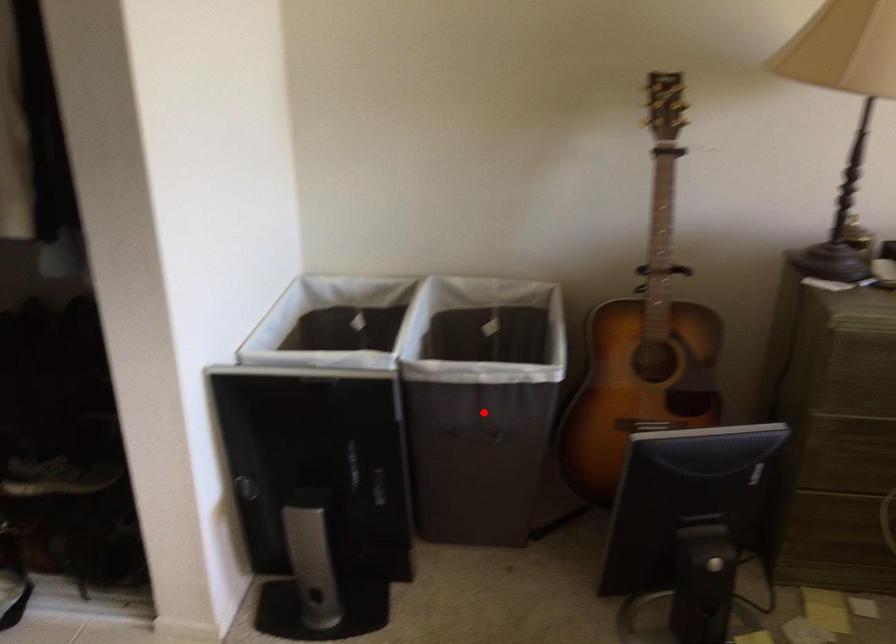
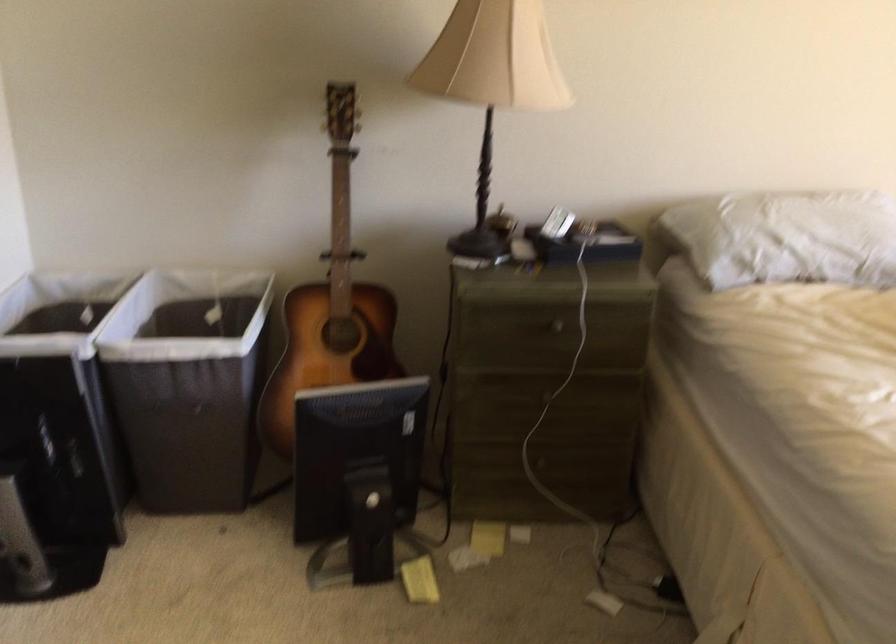
Question: I am providing you with two images of the same scene from different viewpoints. Image1 has a red point marked. In image2, the corresponding 3D location appears at what relative position? Reply with the corresponding letter.

Choices:
 (A) Closer
 (B) Farther

Answer: (B)